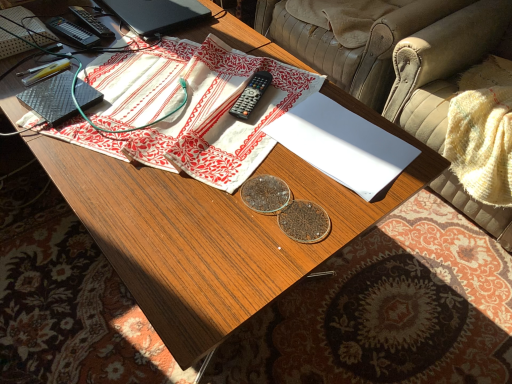
Where is `free point behind black plastic remote at center`? The image size is (512, 384). free point behind black plastic remote at center is located at coordinates (250, 64).